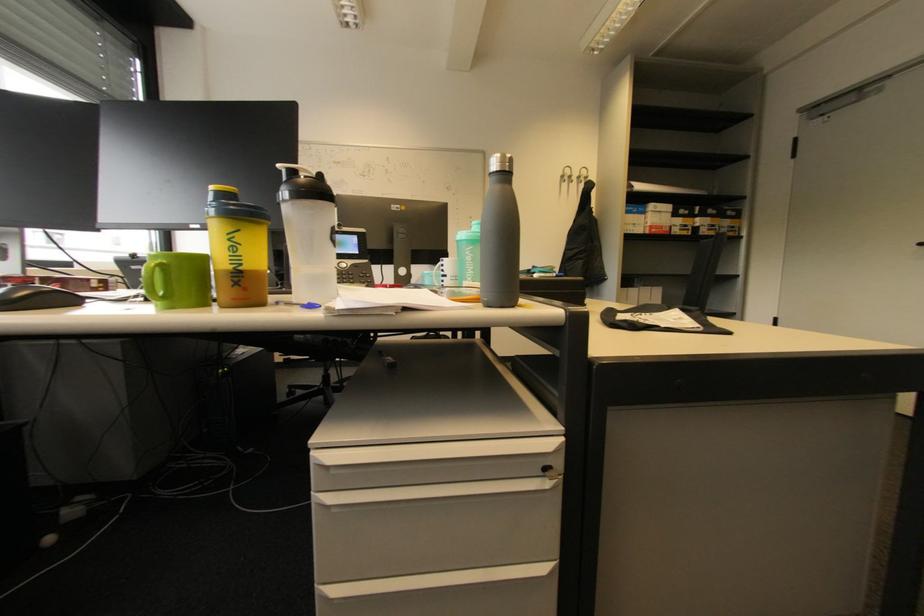
Find the location of a particular element. The width and height of the screenshot is (924, 616). cabinet drawer handle is located at coordinates (435, 450).